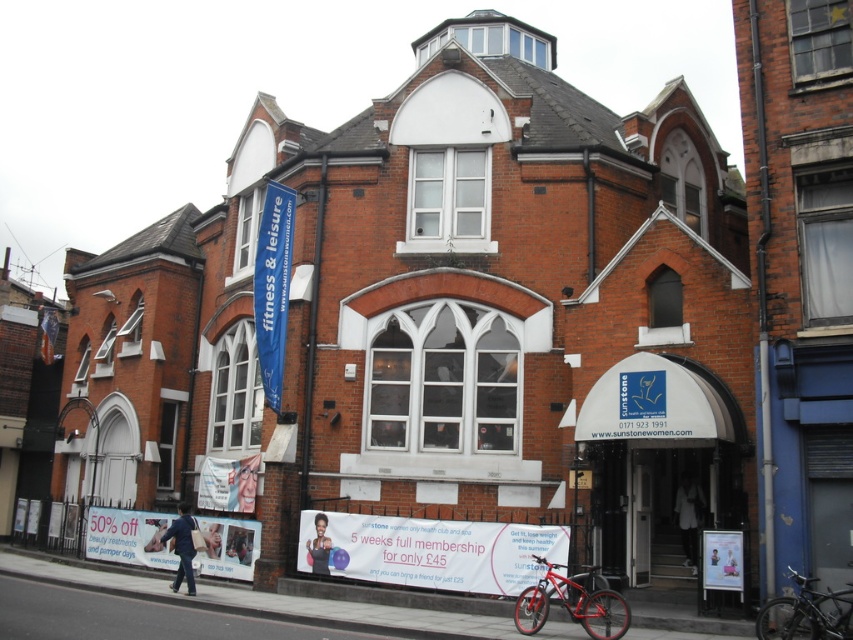
Question: Which object is positioned closest to the white paper sign at lower left?

Choices:
 (A) shiny red bicycle at lower right
 (B) shiny black bicycle at lower right

Answer: (A)

Question: Which is nearer to the shiny black bicycle at lower right?

Choices:
 (A) white glossy banner at lower center
 (B) white paper sign at lower left

Answer: (A)

Question: Based on their relative distances, which object is nearer to the shiny red bicycle at lower right?

Choices:
 (A) shiny black bicycle at lower right
 (B) white glossy banner at lower center
 (C) white paper sign at lower left

Answer: (A)

Question: Does white paper sign at lower left appear under shiny red bicycle at lower right?

Choices:
 (A) no
 (B) yes

Answer: (B)

Question: Is shiny red bicycle at lower right to the left of shiny black bicycle at lower right from the viewer's perspective?

Choices:
 (A) no
 (B) yes

Answer: (B)

Question: Where is white paper sign at lower left located in relation to shiny black bicycle at lower right in the image?

Choices:
 (A) left
 (B) right

Answer: (A)